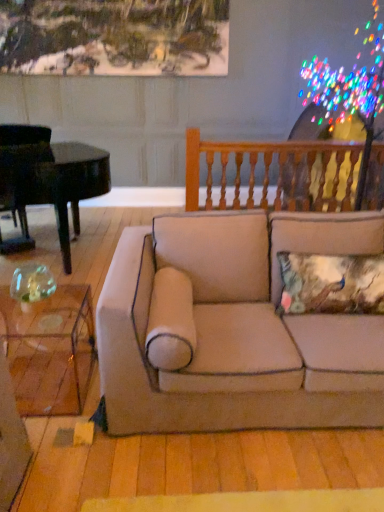
Question: Is transparent glass coffee table at lower left to the left of beige fabric couch at center from the viewer's perspective?

Choices:
 (A) no
 (B) yes

Answer: (B)

Question: Is transparent glass coffee table at lower left far away from beige fabric couch at center?

Choices:
 (A) no
 (B) yes

Answer: (A)

Question: Can you confirm if transparent glass coffee table at lower left is shorter than beige fabric couch at center?

Choices:
 (A) yes
 (B) no

Answer: (A)

Question: Can you confirm if transparent glass coffee table at lower left is thinner than beige fabric couch at center?

Choices:
 (A) yes
 (B) no

Answer: (A)

Question: Is transparent glass coffee table at lower left in front of beige fabric couch at center?

Choices:
 (A) yes
 (B) no

Answer: (B)

Question: Considering the relative positions of transparent glass coffee table at lower left and beige fabric couch at center in the image provided, is transparent glass coffee table at lower left to the right of beige fabric couch at center from the viewer's perspective?

Choices:
 (A) yes
 (B) no

Answer: (B)

Question: Could you tell me if black polished piano at left is turned towards transparent glass coffee table at lower left?

Choices:
 (A) no
 (B) yes

Answer: (B)

Question: From the image's perspective, is black polished piano at left under transparent glass coffee table at lower left?

Choices:
 (A) no
 (B) yes

Answer: (A)

Question: Can you confirm if black polished piano at left is positioned to the left of transparent glass coffee table at lower left?

Choices:
 (A) yes
 (B) no

Answer: (A)

Question: Does black polished piano at left have a smaller size compared to transparent glass coffee table at lower left?

Choices:
 (A) yes
 (B) no

Answer: (B)

Question: Could transparent glass coffee table at lower left be considered to be inside black polished piano at left?

Choices:
 (A) no
 (B) yes

Answer: (A)

Question: Can you confirm if black polished piano at left is taller than transparent glass coffee table at lower left?

Choices:
 (A) yes
 (B) no

Answer: (A)

Question: Does beige fabric couch at center appear on the left side of wooden balusters at upper right?

Choices:
 (A) no
 (B) yes

Answer: (B)